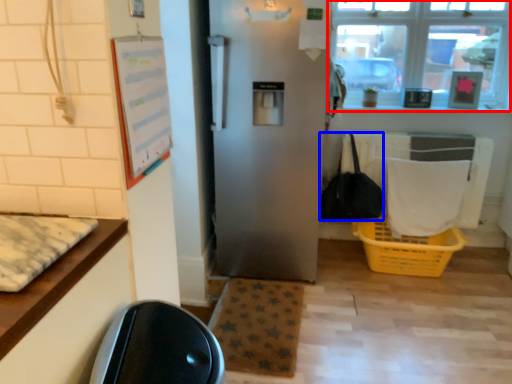
Question: Which object is closer to the camera taking this photo, window (highlighted by a red box) or handbag (highlighted by a blue box)?

Choices:
 (A) window
 (B) handbag

Answer: (B)